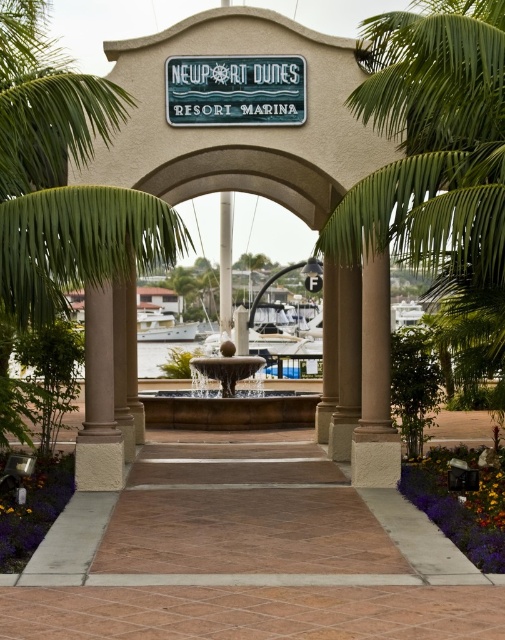
Question: Among these objects, which one is farthest from the camera?

Choices:
 (A) beige stucco column at center
 (B) teal matte sign at center
 (C) smooth stone fountain at center
 (D) beige stone pillar at center

Answer: (D)

Question: Where is brown stone pillar at center located in relation to white glossy boat at center in the image?

Choices:
 (A) right
 (B) left

Answer: (A)

Question: Is teal matte sign at center positioned behind beige stone pillar at center?

Choices:
 (A) no
 (B) yes

Answer: (A)

Question: In this image, where is green leafy palm tree at center located relative to white glossy boat at center?

Choices:
 (A) right
 (B) left

Answer: (A)

Question: Which point is closer to the camera taking this photo?

Choices:
 (A) (191, 65)
 (B) (492, 589)

Answer: (B)

Question: Among these points, which one is farthest from the camera?

Choices:
 (A) (224, 259)
 (B) (156, 326)
 (C) (368, 340)

Answer: (B)